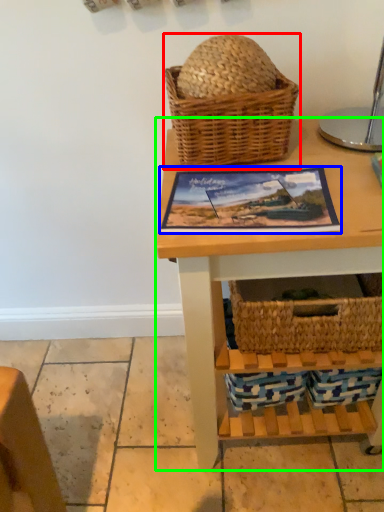
Question: Which object is the closest to the picnic basket (highlighted by a red box)? Choose among these: picture frame (highlighted by a blue box) or table (highlighted by a green box).

Choices:
 (A) picture frame
 (B) table

Answer: (A)